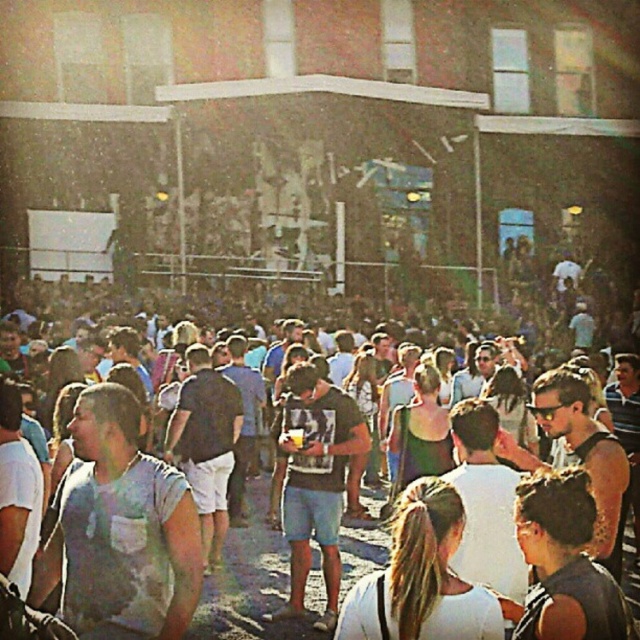
You are organizing a clothing display and need to arrange the light blue cotton shirt at center and the white matte shirt at center side by side. Given their widths, which shirt should be placed on the left to ensure they fit within a 1.2 meter wide display stand?

The light blue cotton shirt at center should be placed on the left since it is narrower than the white matte shirt at center, allowing both to fit within the 1.2 meter wide display stand.